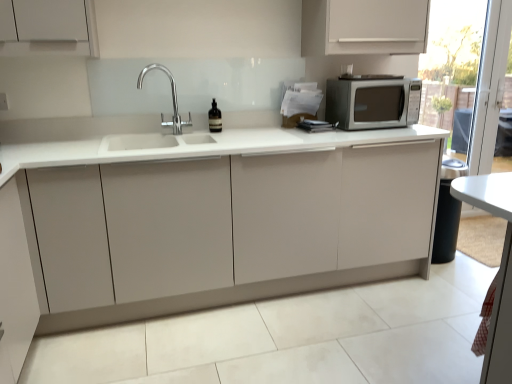
Find the location of a particular element. The height and width of the screenshot is (384, 512). vacant region to the right of chrome/metallic faucet at center is located at coordinates (203, 133).